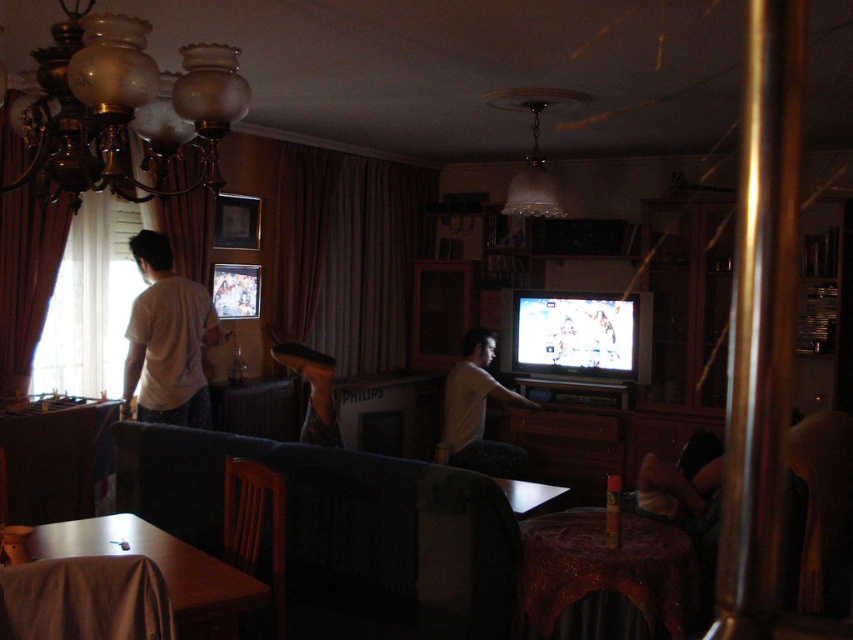
Which is below, dark blue fabric couch at lower center or brown textured curtain at center?

Positioned lower is dark blue fabric couch at lower center.

Does point (496, 577) come in front of point (358, 173)?

Yes, it is in front of point (358, 173).

The image size is (853, 640). In order to click on dark blue fabric couch at lower center in this screenshot , I will do `click(344, 531)`.

Looking at this image, does brown textured curtain at center appear over metallic silver table at lower left?

Indeed, brown textured curtain at center is positioned over metallic silver table at lower left.

Describe the element at coordinates (349, 253) in the screenshot. The image size is (853, 640). I see `brown textured curtain at center` at that location.

I want to click on brown textured curtain at center, so click(349, 253).

Looking at this image, is bronze glass chandelier at upper left shorter than brown textured curtain at center?

Indeed, bronze glass chandelier at upper left has a lesser height compared to brown textured curtain at center.

Is bronze glass chandelier at upper left bigger than brown textured curtain at center?

No.

In order to click on bronze glass chandelier at upper left in this screenshot , I will do `click(125, 108)`.

At what (x,y) coordinates should I click in order to perform the action: click on bronze glass chandelier at upper left. Please return your answer as a coordinate pair (x, y). This screenshot has width=853, height=640. Looking at the image, I should click on (125, 108).